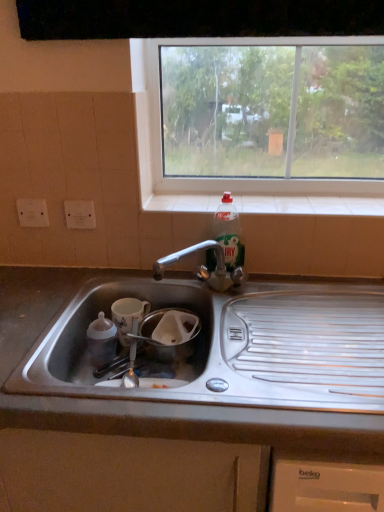
Locate an element on the screen. vacant region in front of translucent plastic bottle at upper right is located at coordinates (232, 294).